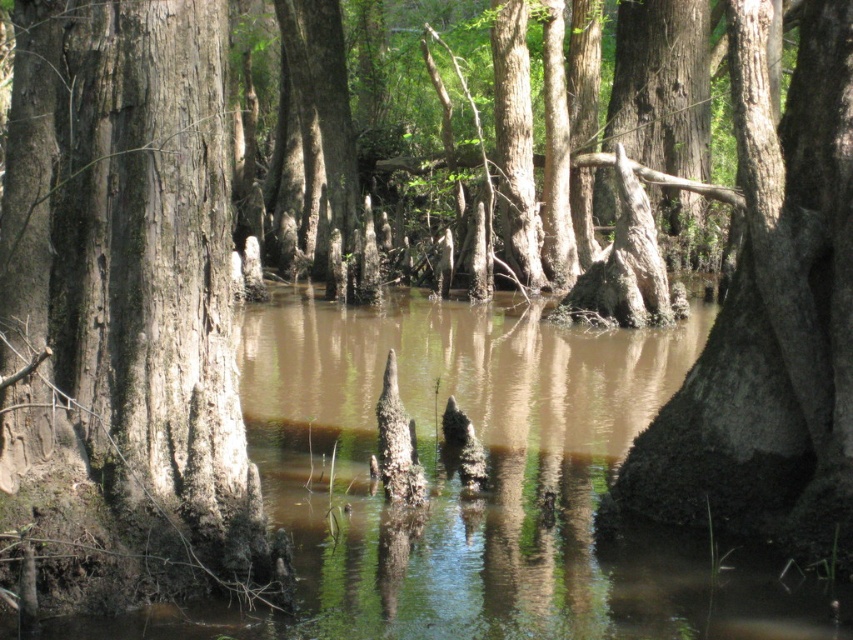
In the swamp scene, there are several tree trunks in the foreground. One of them is marked by the point at (x=125, y=314). What characteristic distinguishes this tree from the others?

The smooth bark tree at center is represented by point (x=125, y=314), so this tree has smooth bark compared to the others with rough, textured bark.

You are a hiker trying to cross the swamp. You see the brown muddy water at center and the smooth gray bark at center. Which one should you avoid stepping on to stay safe?

You should avoid stepping on the brown muddy water at center because it is to the left of smooth gray bark at center, indicating it is a soft, unstable surface. The smooth gray bark at center is likely a solid tree trunk or root that can support your weight safely.